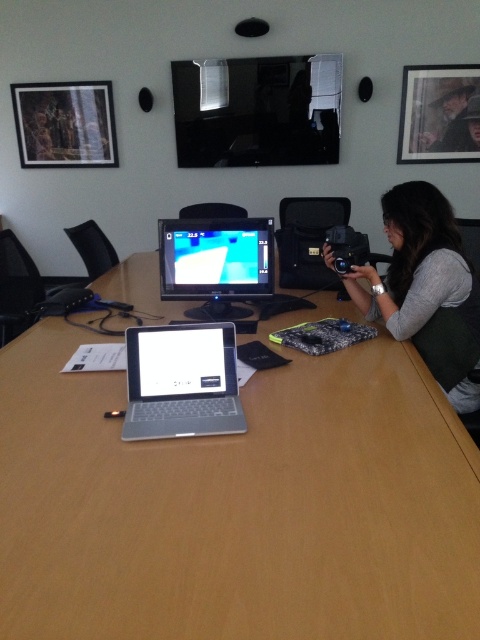
You are a photographer in the conference room. You need to ensure that the matte gray sweater at upper right and the silver metallic laptop at center are both visible in your photo. Given their sizes, which object should you position closer to the camera to ensure both are in focus?

The matte gray sweater at upper right is much taller than the silver metallic laptop at center. To ensure both are in focus, position the taller matte gray sweater at upper right closer to the camera so its size matches the laptop in the frame.

You are standing in the conference room and want to take a photo of the two points mentioned. Which point, point (422, 196) or point (474, 108), will appear larger in your photo?

Point (422, 196) will appear larger in the photo because it is closer to the camera than point (474, 108).

From the picture: You are a photographer in the conference room and want to adjust your focus from the matte gray sweater at upper right to the silver metallic laptop at center. Which object should you move your camera closer to, or adjust the focus to see more clearly?

The matte gray sweater at upper right is closer to you than the silver metallic laptop at center. To focus on the silver metallic laptop at center, you need to adjust the focus to a farther distance since it is behind the sweater.